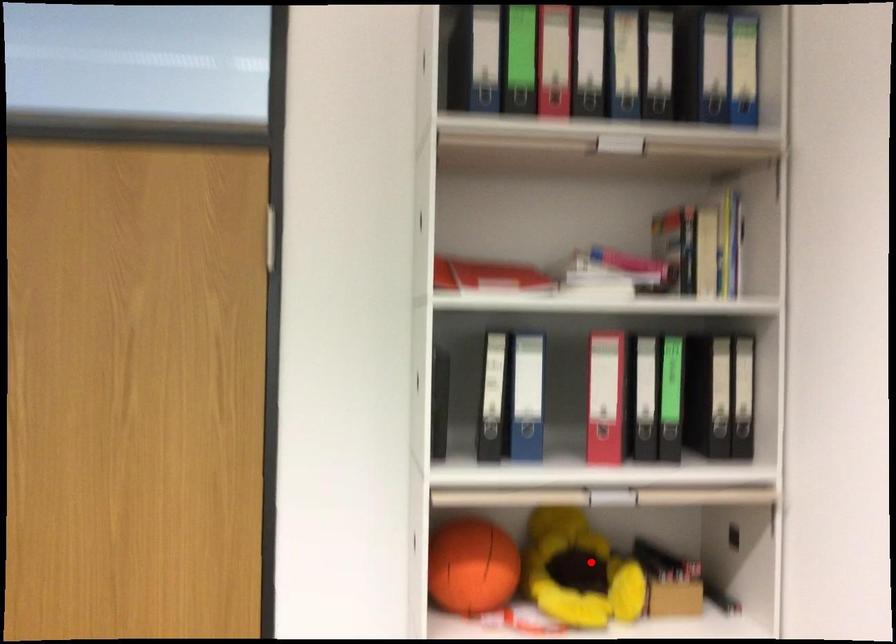
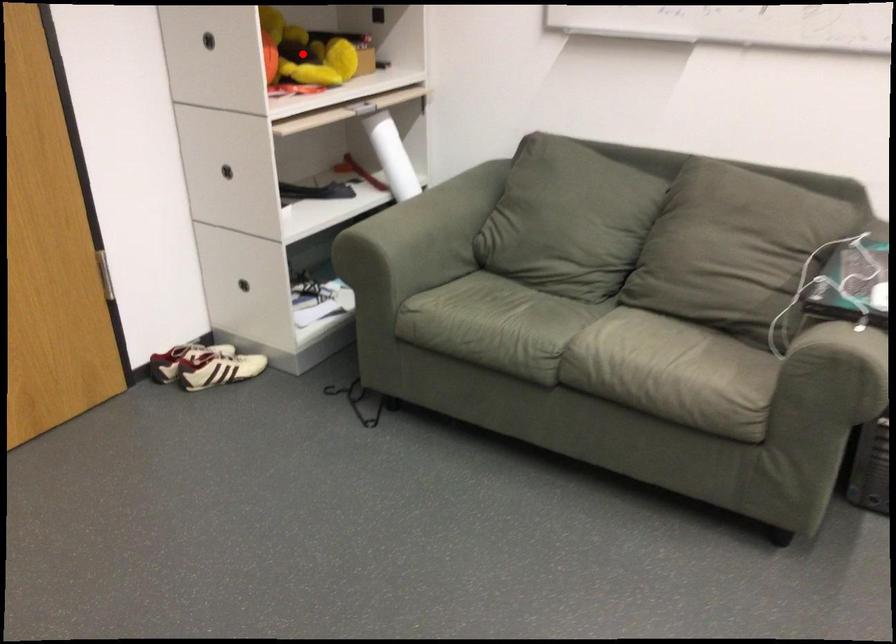
I am providing you with two images of the same scene from different viewpoints. A red point is marked on the first image and another point is marked on the second image. Are the points marked in image1 and image2 representing the same 3D position?

Yes